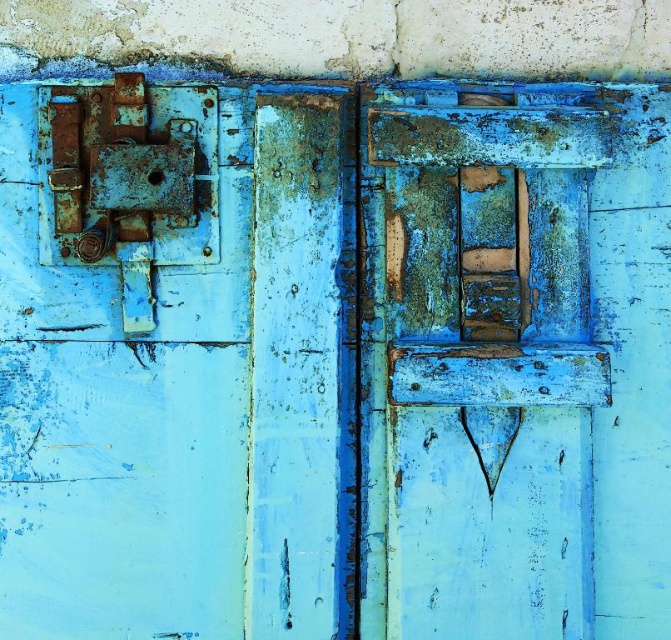
Question: Is rusty metal lock at left bigger than rusty wood door at center?

Choices:
 (A) yes
 (B) no

Answer: (A)

Question: Which point appears farthest from the camera in this image?

Choices:
 (A) (70, 371)
 (B) (552, 227)

Answer: (B)

Question: Which point is closer to the camera?

Choices:
 (A) (570, 356)
 (B) (72, 92)

Answer: (A)

Question: Considering the relative positions of rusty metal lock at left and rusty wood door at center in the image provided, where is rusty metal lock at left located with respect to rusty wood door at center?

Choices:
 (A) right
 (B) left

Answer: (B)

Question: Does rusty metal lock at left appear under rusty wood door at center?

Choices:
 (A) yes
 (B) no

Answer: (A)